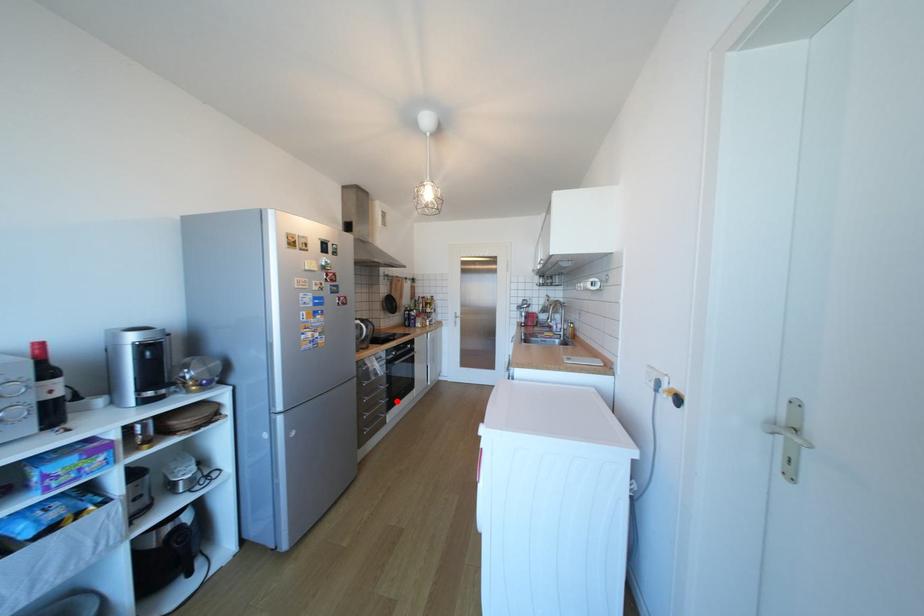
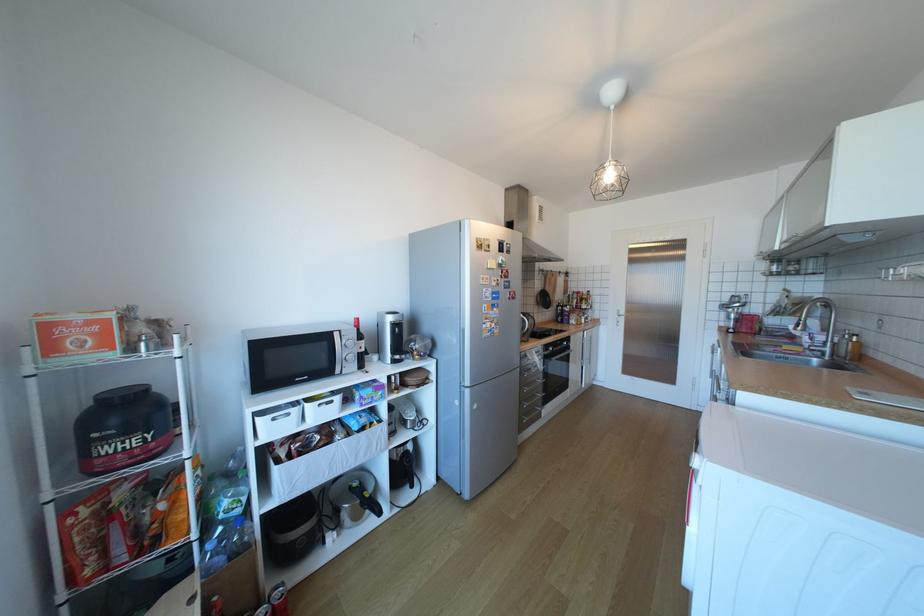
Question: I am providing you with two images of the same scene from different viewpoints. Image1 has a red point marked. In image2, the corresponding 3D location appears at what relative position? Reply with the corresponding letter.

Choices:
 (A) Closer
 (B) Farther

Answer: (B)